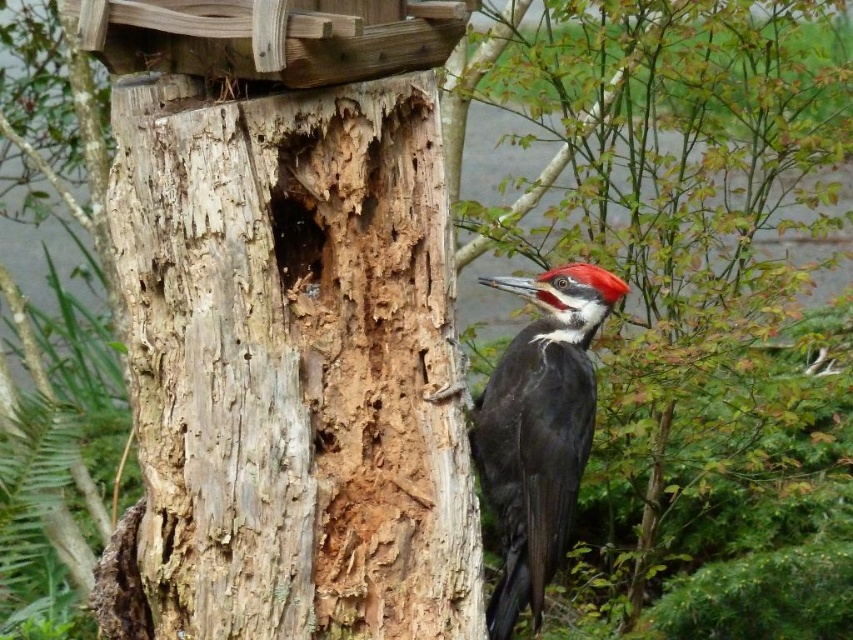
Question: Which object appears closest to the camera in this image?

Choices:
 (A) brown rough wood at center
 (B) smooth bark tree trunk at center
 (C) weathered wood tree trunk at center

Answer: (C)

Question: Can you confirm if smooth bark tree trunk at center is positioned to the left of black glossy woodpecker at center?

Choices:
 (A) no
 (B) yes

Answer: (A)

Question: Is weathered wood tree trunk at center further to camera compared to brown rough wood at center?

Choices:
 (A) yes
 (B) no

Answer: (B)

Question: Which of the following is the farthest from the observer?

Choices:
 (A) weathered wood tree trunk at center
 (B) brown rough wood at center
 (C) smooth bark tree trunk at center

Answer: (C)

Question: Which point is farther from the camera taking this photo?

Choices:
 (A) (531, 577)
 (B) (144, 218)
 (C) (607, 448)

Answer: (C)

Question: From the image, what is the correct spatial relationship of black glossy woodpecker at center in relation to brown rough wood at center?

Choices:
 (A) right
 (B) left

Answer: (A)